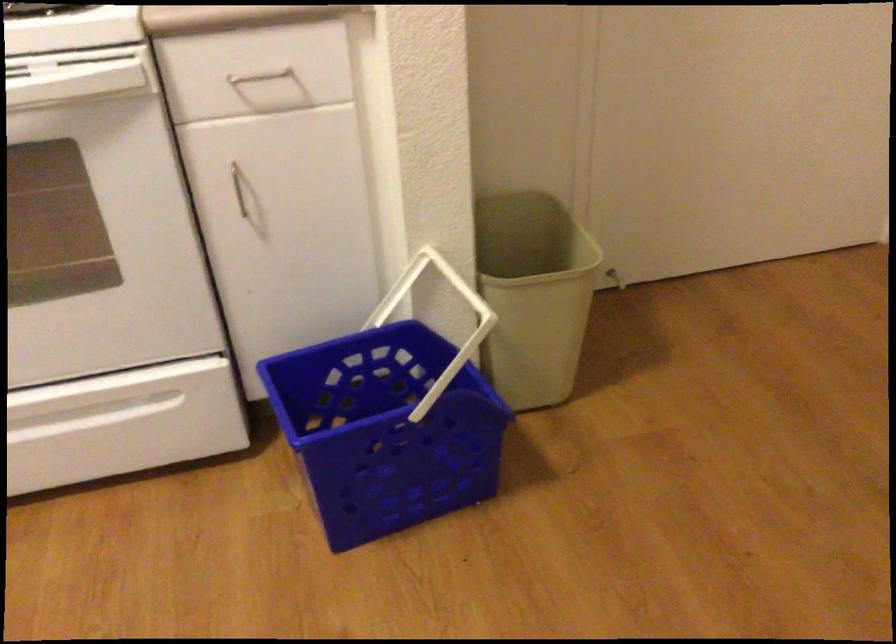
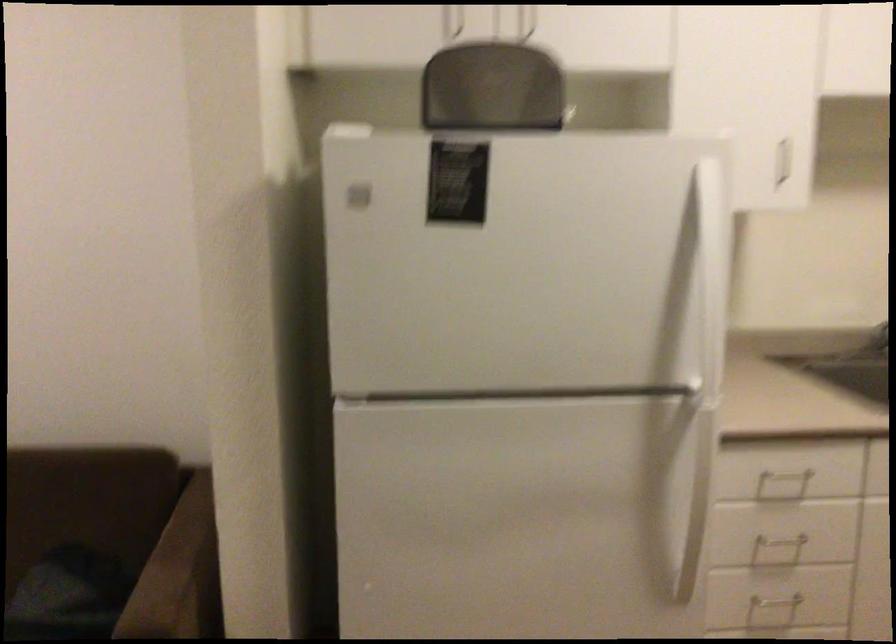
How did the camera likely rotate?

The rotation direction of the camera is left-down.